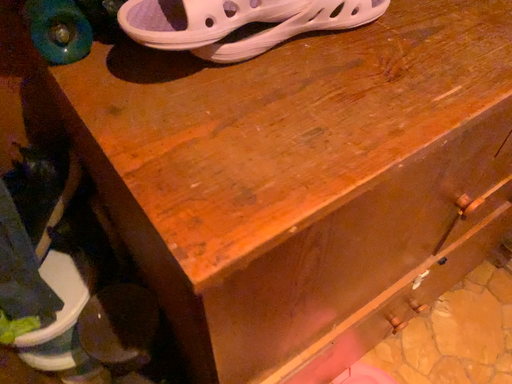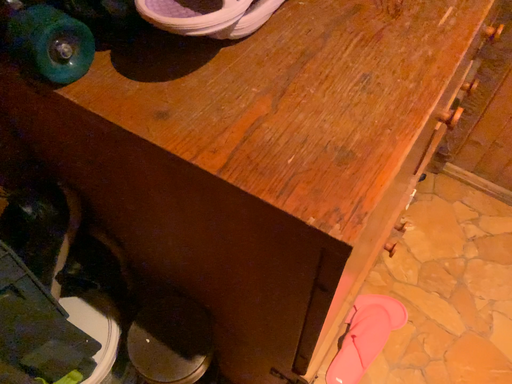
Question: How did the camera likely rotate when shooting the video?

Choices:
 (A) rotated left
 (B) rotated right

Answer: (B)